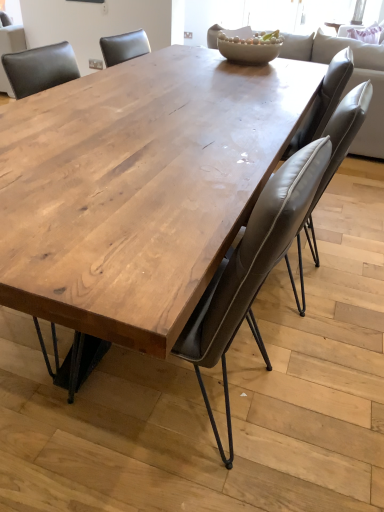
Question: Does point (364, 96) appear closer or farther from the camera than point (39, 52)?

Choices:
 (A) closer
 (B) farther

Answer: (A)

Question: In terms of width, does leather at center, acting as the 2th chair starting from the left, look wider or thinner when compared to matte wood table at center, acting as the first chair starting from the left?

Choices:
 (A) wide
 (B) thin

Answer: (A)

Question: Which is nearer to the light gray leather couch at upper center?

Choices:
 (A) matte wood table at center, which ranks as the second chair in right-to-left order
 (B) leather at center, acting as the 2th chair starting from the left
 (C) matte ceramic bowl at center
 (D) natural wood table at center

Answer: (C)

Question: Which is farther from the light gray leather couch at upper center?

Choices:
 (A) matte ceramic bowl at center
 (B) matte wood table at center, acting as the first chair starting from the left
 (C) natural wood table at center
 (D) leather at center, the 1th chair when ordered from right to left

Answer: (B)